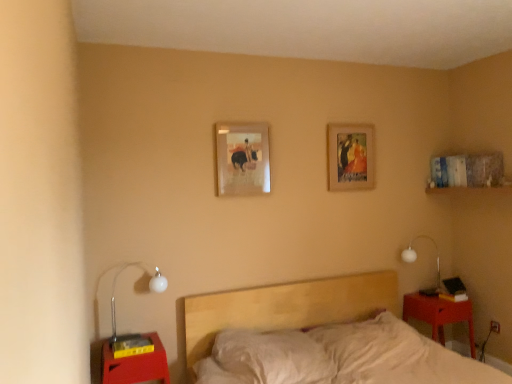
Where is `matte red wood nightstand at lower right, marked as the first nightstand in a right-to-left arrangement`? matte red wood nightstand at lower right, marked as the first nightstand in a right-to-left arrangement is located at coordinates (439, 315).

Image resolution: width=512 pixels, height=384 pixels. Describe the element at coordinates (115, 291) in the screenshot. I see `white glass lamp at left, arranged as the 1th lamp when viewed from the front` at that location.

Where is `matte wooden picture frame at center, which is counted as the 2th picture frame, starting from the back`? matte wooden picture frame at center, which is counted as the 2th picture frame, starting from the back is located at coordinates (242, 159).

What is the approximate height of white glass lamp at right, which is counted as the 2th lamp, starting from the left?

white glass lamp at right, which is counted as the 2th lamp, starting from the left, is 19.62 inches in height.

The image size is (512, 384). What do you see at coordinates (135, 365) in the screenshot?
I see `matte red nightstand at lower left, acting as the 2th nightstand starting from the back` at bounding box center [135, 365].

The width and height of the screenshot is (512, 384). What are the coordinates of `matte red wood nightstand at lower right, marked as the first nightstand in a right-to-left arrangement` in the screenshot? It's located at (439, 315).

At what (x,y) coordinates should I click in order to perform the action: click on nightstand lying above the matte red nightstand at lower left, acting as the 2th nightstand starting from the back (from the image's perspective). Please return your answer as a coordinate pair (x, y). Looking at the image, I should click on (439, 315).

Considering the sizes of objects matte red wood nightstand at lower right, the first nightstand positioned from the back, and matte red nightstand at lower left, the 2th nightstand in the right-to-left sequence, in the image provided, who is thinner, matte red wood nightstand at lower right, the first nightstand positioned from the back, or matte red nightstand at lower left, the 2th nightstand in the right-to-left sequence,?

With smaller width is matte red wood nightstand at lower right, the first nightstand positioned from the back.

From the image's perspective, is matte red wood nightstand at lower right, marked as the first nightstand in a right-to-left arrangement, above or below matte red nightstand at lower left, acting as the 2th nightstand starting from the back?

From the image's perspective, matte red wood nightstand at lower right, marked as the first nightstand in a right-to-left arrangement, appears above matte red nightstand at lower left, acting as the 2th nightstand starting from the back.

From the image's perspective, which object appears higher, matte wooden picture frame at center, which is counted as the first picture frame, starting from the left, or matte red nightstand at lower left, which is the first nightstand in front-to-back order?

matte wooden picture frame at center, which is counted as the first picture frame, starting from the left, from the image's perspective.

From a real-world perspective, is matte wooden picture frame at center, which is the first picture frame from front to back, above or below matte red nightstand at lower left, the 2th nightstand in the right-to-left sequence?

matte wooden picture frame at center, which is the first picture frame from front to back, is above matte red nightstand at lower left, the 2th nightstand in the right-to-left sequence.

Is matte wooden picture frame at center, which is the first picture frame from front to back, directly adjacent to matte red nightstand at lower left, acting as the 2th nightstand starting from the back?

No, matte wooden picture frame at center, which is the first picture frame from front to back, is not making contact with matte red nightstand at lower left, acting as the 2th nightstand starting from the back.

In the scene shown: Which object is more forward, matte wooden picture frame at center, which is counted as the 2th picture frame, starting from the back, or matte red nightstand at lower left, acting as the 2th nightstand starting from the back?

matte red nightstand at lower left, acting as the 2th nightstand starting from the back, is in front.

Is matte red nightstand at lower left, the first nightstand when ordered from left to right, shorter than white glass lamp at right, which ranks as the first lamp in back-to-front order?

Correct, matte red nightstand at lower left, the first nightstand when ordered from left to right, is not as tall as white glass lamp at right, which ranks as the first lamp in back-to-front order.

From the picture: How many degrees apart are the facing directions of matte red nightstand at lower left, the first nightstand when ordered from left to right, and white glass lamp at right, the first lamp from the right?

They differ by 0.938 degrees in their facing directions.

From the image's perspective, is matte red nightstand at lower left, acting as the 2th nightstand starting from the back, below white glass lamp at right, which ranks as the first lamp in back-to-front order?

Yes, from the image's perspective, matte red nightstand at lower left, acting as the 2th nightstand starting from the back, is below white glass lamp at right, which ranks as the first lamp in back-to-front order.

Between point (148, 354) and point (410, 257), which one is positioned behind?

Point (410, 257)

Is point (364, 130) closer or farther from the camera than point (238, 155)?

Point (364, 130) appears to be farther away from the viewer than point (238, 155).

In the image, is wooden picture frame at upper center, arranged as the 2th picture frame when viewed from the left, positioned in front of or behind matte wooden picture frame at center, which is the first picture frame from front to back?

wooden picture frame at upper center, arranged as the 2th picture frame when viewed from the left, is positioned farther from the viewer than matte wooden picture frame at center, which is the first picture frame from front to back.

Which of these two, wooden picture frame at upper center, arranged as the 1th picture frame when viewed from the right, or matte wooden picture frame at center, which is the first picture frame from front to back, is wider?

Wider between the two is wooden picture frame at upper center, arranged as the 1th picture frame when viewed from the right.

In the scene shown: Is wooden picture frame at upper center, arranged as the 1th picture frame when viewed from the right, not within matte wooden picture frame at center, marked as the 2th picture frame in a right-to-left arrangement?

Indeed, wooden picture frame at upper center, arranged as the 1th picture frame when viewed from the right, is completely outside matte wooden picture frame at center, marked as the 2th picture frame in a right-to-left arrangement.

How different are the orientations of white glass lamp at right, which is counted as the 2th lamp, starting from the left, and light wood bed at center in degrees?

The facing directions of white glass lamp at right, which is counted as the 2th lamp, starting from the left, and light wood bed at center are 0.915 degrees apart.

Does white glass lamp at right, which ranks as the second lamp in front-to-back order, have a smaller size compared to light wood bed at center?

Yes.

From the image's perspective, is white glass lamp at right, the first lamp from the right, positioned above or below light wood bed at center?

white glass lamp at right, the first lamp from the right, is above light wood bed at center.

Is light wood bed at center inside white glass lamp at right, which is counted as the 2th lamp, starting from the left?

That's incorrect, light wood bed at center is not inside white glass lamp at right, which is counted as the 2th lamp, starting from the left.

How much distance is there between light wood bed at center and white glass lamp at right, which ranks as the second lamp in front-to-back order?

light wood bed at center and white glass lamp at right, which ranks as the second lamp in front-to-back order, are 37.20 inches apart from each other.

Is light wood bed at center outside of white glass lamp at right, which is counted as the 2th lamp, starting from the left?

Yes, light wood bed at center is located beyond the bounds of white glass lamp at right, which is counted as the 2th lamp, starting from the left.

Is light wood bed at center positioned in front of white glass lamp at right, which is counted as the 2th lamp, starting from the left?

Yes, light wood bed at center is closer to the viewer.

From a real-world perspective, between light wood bed at center and white glass lamp at right, the first lamp from the right, who is vertically lower?

light wood bed at center.

Which is nearer, (471, 317) or (370, 178)?

Positioned in front is point (471, 317).

How distant is matte red wood nightstand at lower right, arranged as the 2th nightstand when viewed from the left, from wooden picture frame at upper center, the 2th picture frame from the front?

matte red wood nightstand at lower right, arranged as the 2th nightstand when viewed from the left, and wooden picture frame at upper center, the 2th picture frame from the front, are 4.04 feet apart from each other.

How many degrees apart are the facing directions of matte red wood nightstand at lower right, the first nightstand positioned from the back, and wooden picture frame at upper center, the 2th picture frame from the front?

0.501 degrees separate the facing orientations of matte red wood nightstand at lower right, the first nightstand positioned from the back, and wooden picture frame at upper center, the 2th picture frame from the front.

Is matte red wood nightstand at lower right, placed as the 2th nightstand when sorted from front to back, smaller than wooden picture frame at upper center, the first picture frame viewed from the back?

No.

The width and height of the screenshot is (512, 384). I want to click on nightstand on the left of matte red wood nightstand at lower right, placed as the 2th nightstand when sorted from front to back, so click(135, 365).

From a real-world perspective, starting from the matte wooden picture frame at center, which is the first picture frame from front to back, which nightstand is the 1st one below it? Please provide its 2D coordinates.

[(135, 365)]

When comparing their distances from white glass lamp at left, acting as the 2th lamp starting from the back, does light wood bed at center or white glass lamp at right, the first lamp from the right, seem further?

white glass lamp at right, the first lamp from the right, is positioned further to the anchor white glass lamp at left, acting as the 2th lamp starting from the back.

Considering their positions, is white glass lamp at right, which ranks as the first lamp in back-to-front order, positioned further to matte red nightstand at lower left, the first nightstand when ordered from left to right, than white glass lamp at left, arranged as the 1th lamp when viewed from the front?

Based on the image, white glass lamp at right, which ranks as the first lamp in back-to-front order, appears to be further to matte red nightstand at lower left, the first nightstand when ordered from left to right.

From the image, which object appears to be nearer to white glass lamp at left, acting as the 2th lamp starting from the back, wooden picture frame at upper center, arranged as the 2th picture frame when viewed from the left, or white glass lamp at right, which is counted as the 2th lamp, starting from the left?

wooden picture frame at upper center, arranged as the 2th picture frame when viewed from the left, is closer to white glass lamp at left, acting as the 2th lamp starting from the back.

From the picture: Considering their positions, is white glass lamp at right, which is counted as the 2th lamp, starting from the left, positioned further to white glass lamp at left, acting as the 2th lamp starting from the back, than matte red nightstand at lower left, which is the first nightstand in front-to-back order?

Among the two, white glass lamp at right, which is counted as the 2th lamp, starting from the left, is located further to white glass lamp at left, acting as the 2th lamp starting from the back.

From the image, which object appears to be farther from matte red wood nightstand at lower right, the first nightstand positioned from the back, matte wooden picture frame at center, which is the first picture frame from front to back, or wooden picture frame at upper center, arranged as the 1th picture frame when viewed from the right?

Based on the image, matte wooden picture frame at center, which is the first picture frame from front to back, appears to be further to matte red wood nightstand at lower right, the first nightstand positioned from the back.

Based on their spatial positions, is matte wooden picture frame at center, which is counted as the 2th picture frame, starting from the back, or white glass lamp at left, which is the first lamp from left to right, closer to wooden picture frame at upper center, the 2th picture frame from the front?

The object closer to wooden picture frame at upper center, the 2th picture frame from the front, is matte wooden picture frame at center, which is counted as the 2th picture frame, starting from the back.

From the image, which object appears to be nearer to white glass lamp at left, acting as the 2th lamp starting from the back, wooden picture frame at upper center, arranged as the 2th picture frame when viewed from the left, or matte wooden picture frame at center, which is the first picture frame from front to back?

matte wooden picture frame at center, which is the first picture frame from front to back.

When comparing their distances from matte red nightstand at lower left, the 2th nightstand in the right-to-left sequence, does matte red wood nightstand at lower right, marked as the first nightstand in a right-to-left arrangement, or matte wooden picture frame at center, which is the first picture frame from front to back, seem further?

The object further to matte red nightstand at lower left, the 2th nightstand in the right-to-left sequence, is matte red wood nightstand at lower right, marked as the first nightstand in a right-to-left arrangement.

Image resolution: width=512 pixels, height=384 pixels. In order to click on picture frame positioned between light wood bed at center and wooden picture frame at upper center, arranged as the 2th picture frame when viewed from the left, from near to far in this screenshot , I will do `click(242, 159)`.

Locate an element on the screen. The image size is (512, 384). bed between white glass lamp at left, which is the first lamp from left to right, and white glass lamp at right, which ranks as the second lamp in front-to-back order, from left to right is located at coordinates (286, 307).

Identify the location of lamp between light wood bed at center and matte wooden picture frame at center, which is counted as the first picture frame, starting from the left, in the front-back direction. (115, 291).

Where is `picture frame between wooden picture frame at upper center, arranged as the 1th picture frame when viewed from the right, and matte red wood nightstand at lower right, marked as the first nightstand in a right-to-left arrangement, in the up-down direction`? The image size is (512, 384). picture frame between wooden picture frame at upper center, arranged as the 1th picture frame when viewed from the right, and matte red wood nightstand at lower right, marked as the first nightstand in a right-to-left arrangement, in the up-down direction is located at coordinates [x=242, y=159].